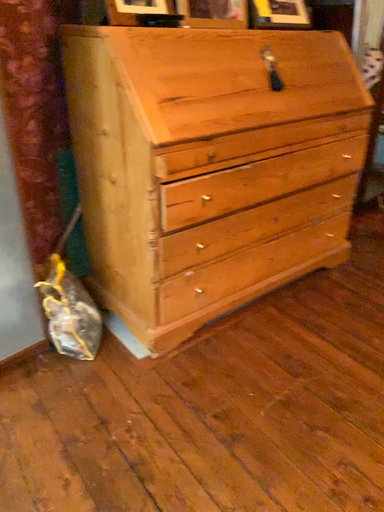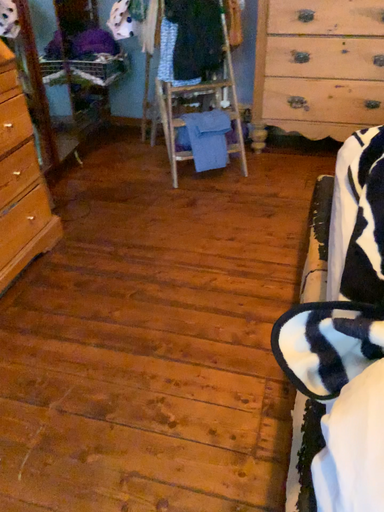
Question: How did the camera likely rotate when shooting the video?

Choices:
 (A) rotated left
 (B) rotated right

Answer: (B)